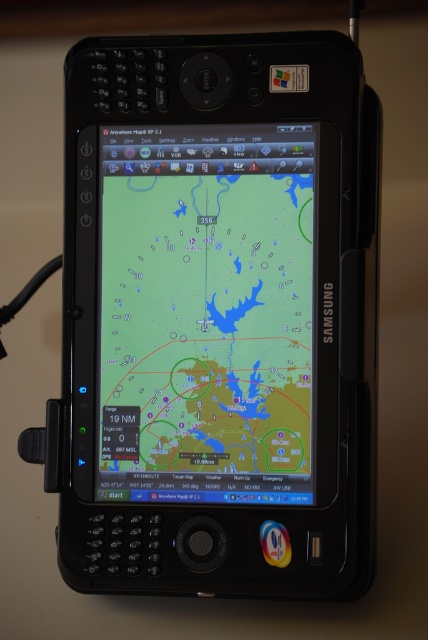
You are a pilot preparing for a flight and need to check the flight navigation app on your devices. You have a black plastic smartphone at center and a matte screen map at center. Which device has a bigger screen?

The black plastic smartphone at center has a larger screen than the matte screen map at center.

You are a pilot preparing for a flight and need to check your navigation tools. You have a black plastic smartphone at center and a matte screen map at center on your dashboard. Can you easily reach both items simultaneously with your left and right hands while maintaining control of the aircraft?

The distance between the black plastic smartphone at center and the matte screen map at center is 0.71 inches, which is very close. Since they are so near to each other, you can easily reach both items simultaneously with your left and right hands while maintaining control of the aircraft.